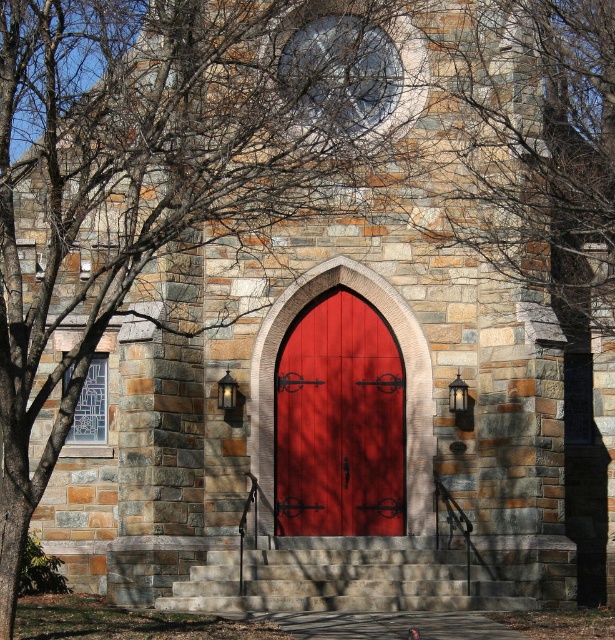
Question: Does matte wood door at center appear on the right side of stone steps at center?

Choices:
 (A) no
 (B) yes

Answer: (A)

Question: Which point is closer to the camera?

Choices:
 (A) click(450, 563)
 (B) click(335, 376)

Answer: (A)

Question: Can you confirm if matte wood door at center is positioned to the right of stone steps at center?

Choices:
 (A) yes
 (B) no

Answer: (B)

Question: Where is matte wood door at center located in relation to stone steps at center in the image?

Choices:
 (A) right
 (B) left

Answer: (B)

Question: Among these points, which one is farthest from the camera?

Choices:
 (A) (490, 609)
 (B) (300, 524)

Answer: (B)

Question: Among these points, which one is farthest from the camera?

Choices:
 (A) (320, 419)
 (B) (292, 554)

Answer: (A)